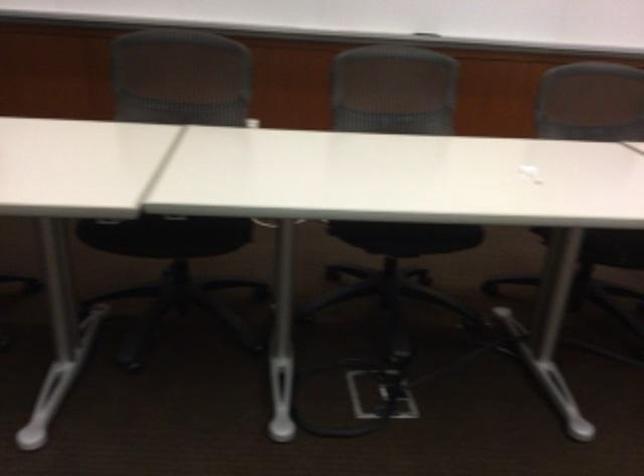
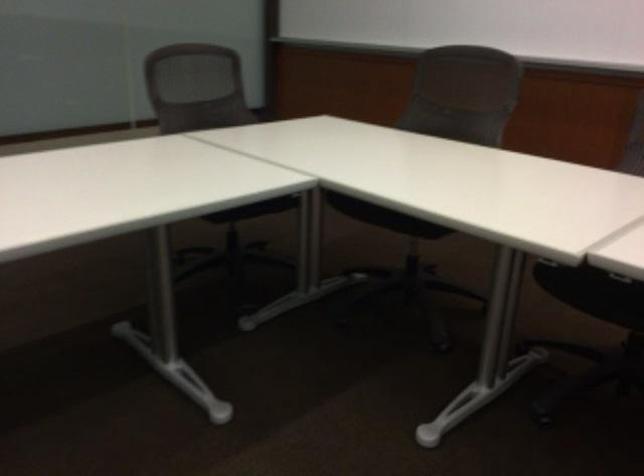
In the second image, find the point that corresponds to the point at 142,232 in the first image.

(592, 292)